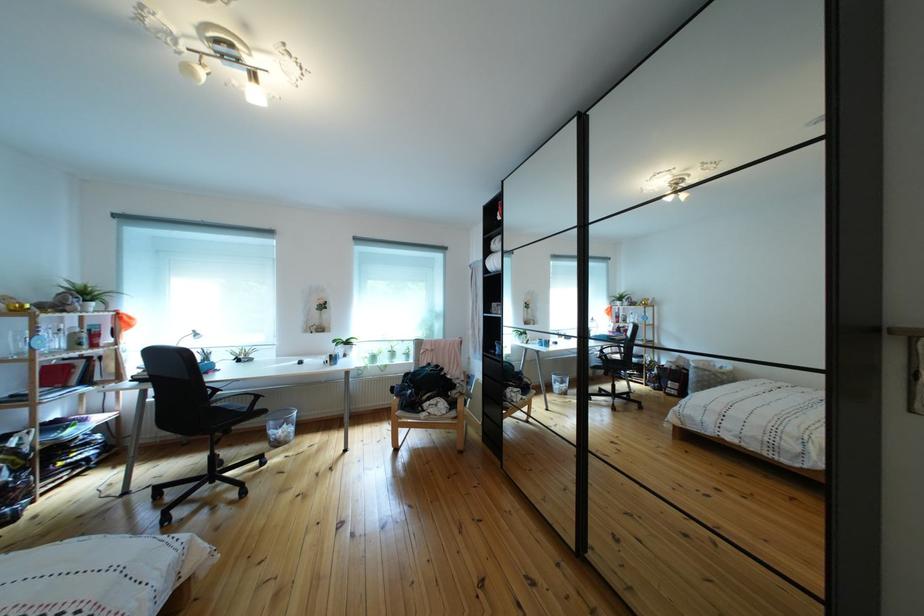
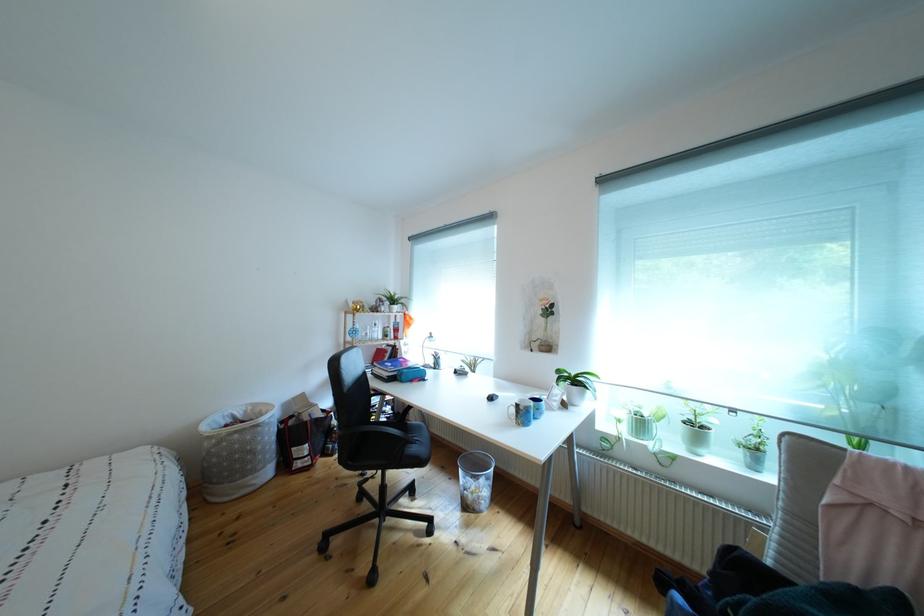
In the second image, find the point that corresponds to [64,358] in the first image.

(383, 345)